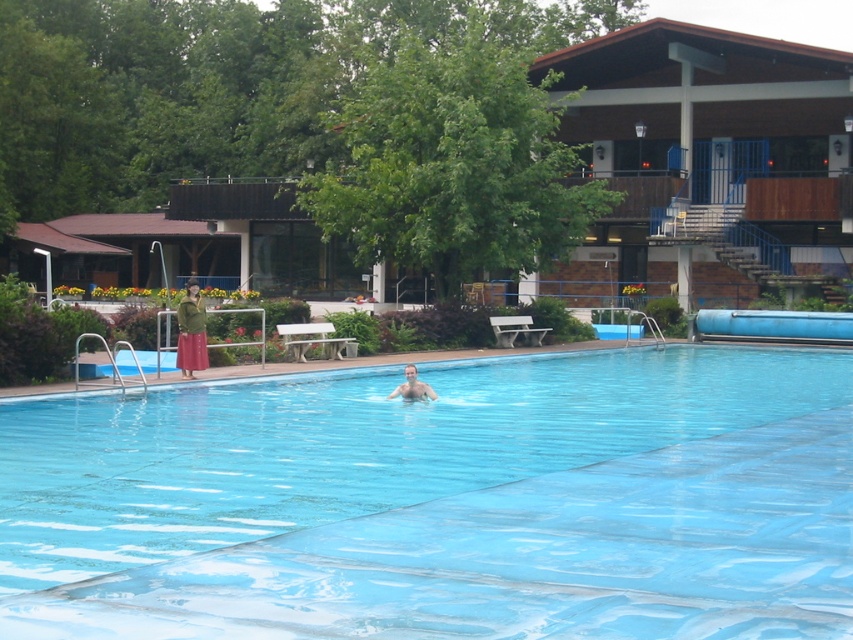
You are a lifeguard on duty and need to assess the distance between the transparent plastic pool at center and the smooth skin person at center. Based on the scene, can you determine if the pool is directly under the person?

The transparent plastic pool at center is below smooth skin person at center, so yes, the pool is directly under the person.

You are a photographer taking a picture of the transparent plastic pool at center and the green textured dress at left. Which object will appear larger in the photo?

The transparent plastic pool at center will appear larger in the photo because it is closer to the viewer than the green textured dress at left.